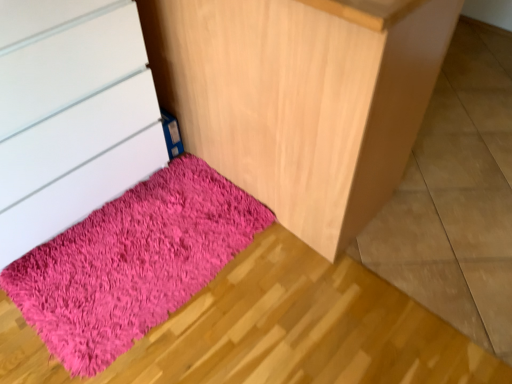
At what (x,y) coordinates should I click in order to perform the action: click on matte white chest of drawers at lower left. Please return your answer as a coordinate pair (x, y). Looking at the image, I should click on pyautogui.click(x=74, y=125).

What is the approximate height of matte white chest of drawers at lower left?

matte white chest of drawers at lower left is 32.53 inches tall.

The height and width of the screenshot is (384, 512). What do you see at coordinates (132, 262) in the screenshot?
I see `shaggy pink rug at lower left` at bounding box center [132, 262].

Locate an element on the screen. fuzzy pink rug at lower left is located at coordinates (301, 98).

Is shaggy pink rug at lower left to the left of matte white chest of drawers at lower left from the viewer's perspective?

In fact, shaggy pink rug at lower left is to the right of matte white chest of drawers at lower left.

Can we say shaggy pink rug at lower left lies outside matte white chest of drawers at lower left?

Yes.

From a real-world perspective, relative to matte white chest of drawers at lower left, is shaggy pink rug at lower left vertically above or below?

shaggy pink rug at lower left is below matte white chest of drawers at lower left.

Does fuzzy pink rug at lower left appear on the left side of matte white chest of drawers at lower left?

No, fuzzy pink rug at lower left is not to the left of matte white chest of drawers at lower left.

From a real-world perspective, is fuzzy pink rug at lower left positioned under matte white chest of drawers at lower left based on gravity?

No, from a real-world perspective, fuzzy pink rug at lower left is not below matte white chest of drawers at lower left.

Considering the relative sizes of fuzzy pink rug at lower left and matte white chest of drawers at lower left in the image provided, is fuzzy pink rug at lower left thinner than matte white chest of drawers at lower left?

No, fuzzy pink rug at lower left is not thinner than matte white chest of drawers at lower left.

Is fuzzy pink rug at lower left facing away from matte white chest of drawers at lower left?

No, fuzzy pink rug at lower left is not facing away from matte white chest of drawers at lower left.

Considering the points (331, 157) and (129, 221), which point is in front, point (331, 157) or point (129, 221)?

The point (331, 157) is in front.

Based on the photo, can you confirm if fuzzy pink rug at lower left is shorter than shaggy pink rug at lower left?

No, fuzzy pink rug at lower left is not shorter than shaggy pink rug at lower left.

Would you say fuzzy pink rug at lower left is inside or outside shaggy pink rug at lower left?

fuzzy pink rug at lower left is not enclosed by shaggy pink rug at lower left.

In the scene shown: Which is behind, fuzzy pink rug at lower left or shaggy pink rug at lower left?

shaggy pink rug at lower left is more distant.

How much distance is there between matte white chest of drawers at lower left and shaggy pink rug at lower left?

The distance of matte white chest of drawers at lower left from shaggy pink rug at lower left is 12.99 inches.

Is matte white chest of drawers at lower left aimed at shaggy pink rug at lower left?

Yes, matte white chest of drawers at lower left is oriented towards shaggy pink rug at lower left.

Which of these two, matte white chest of drawers at lower left or shaggy pink rug at lower left, stands taller?

With more height is matte white chest of drawers at lower left.

From the image's perspective, does matte white chest of drawers at lower left appear higher than fuzzy pink rug at lower left?

No, from the image's perspective, matte white chest of drawers at lower left is not above fuzzy pink rug at lower left.

Can you confirm if matte white chest of drawers at lower left is positioned to the left of fuzzy pink rug at lower left?

Yes, matte white chest of drawers at lower left is to the left of fuzzy pink rug at lower left.

Measure the distance from matte white chest of drawers at lower left to fuzzy pink rug at lower left.

A distance of 19.27 inches exists between matte white chest of drawers at lower left and fuzzy pink rug at lower left.

Is matte white chest of drawers at lower left positioned beyond the bounds of fuzzy pink rug at lower left?

matte white chest of drawers at lower left is positioned outside fuzzy pink rug at lower left.

Could you tell me if shaggy pink rug at lower left is facing fuzzy pink rug at lower left?

No, shaggy pink rug at lower left does not turn towards fuzzy pink rug at lower left.

Which is farther, (146,233) or (430,8)?

The point (146,233) is farther.

Are shaggy pink rug at lower left and fuzzy pink rug at lower left making contact?

No, shaggy pink rug at lower left is not beside fuzzy pink rug at lower left.

Is shaggy pink rug at lower left bigger than fuzzy pink rug at lower left?

Incorrect, shaggy pink rug at lower left is not larger than fuzzy pink rug at lower left.

At what (x,y) coordinates should I click in order to perform the action: click on chest of drawers above the shaggy pink rug at lower left (from a real-world perspective). Please return your answer as a coordinate pair (x, y). The height and width of the screenshot is (384, 512). Looking at the image, I should click on (74, 125).

Locate an element on the screen. furniture to the right of matte white chest of drawers at lower left is located at coordinates (301, 98).

Estimate the real-world distances between objects in this image. Which object is closer to matte white chest of drawers at lower left, shaggy pink rug at lower left or fuzzy pink rug at lower left?

shaggy pink rug at lower left lies closer to matte white chest of drawers at lower left than the other object.

Looking at the image, which one is located closer to shaggy pink rug at lower left, fuzzy pink rug at lower left or matte white chest of drawers at lower left?

The object closer to shaggy pink rug at lower left is matte white chest of drawers at lower left.

Considering their positions, is fuzzy pink rug at lower left positioned closer to matte white chest of drawers at lower left than shaggy pink rug at lower left?

shaggy pink rug at lower left is closer to matte white chest of drawers at lower left.

Looking at the image, which one is located closer to shaggy pink rug at lower left, matte white chest of drawers at lower left or fuzzy pink rug at lower left?

The object closer to shaggy pink rug at lower left is matte white chest of drawers at lower left.

Consider the image. Estimate the real-world distances between objects in this image. Which object is further from fuzzy pink rug at lower left, shaggy pink rug at lower left or matte white chest of drawers at lower left?

shaggy pink rug at lower left is further to fuzzy pink rug at lower left.

From the image, which object appears to be nearer to fuzzy pink rug at lower left, matte white chest of drawers at lower left or shaggy pink rug at lower left?

matte white chest of drawers at lower left.

At what (x,y) coordinates should I click in order to perform the action: click on mat between matte white chest of drawers at lower left and fuzzy pink rug at lower left in the horizontal direction. Please return your answer as a coordinate pair (x, y). Image resolution: width=512 pixels, height=384 pixels. Looking at the image, I should click on (132, 262).